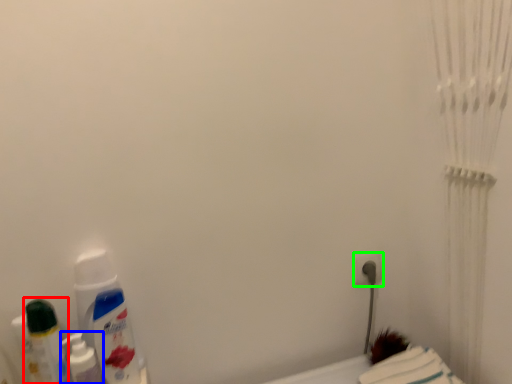
Question: Based on their relative distances, which object is nearer to mouthwash (highlighted by a red box)? Choose from mouthwash (highlighted by a blue box) and power plugs and sockets (highlighted by a green box).

Choices:
 (A) mouthwash
 (B) power plugs and sockets

Answer: (A)